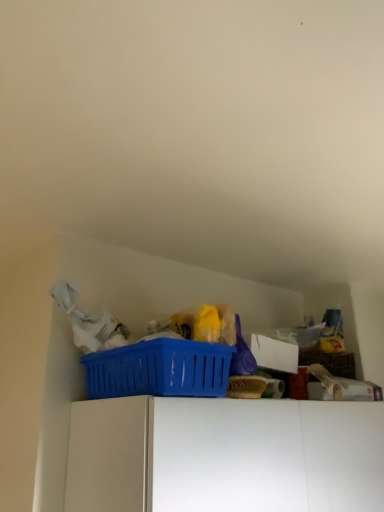
Question: Can you confirm if blue plastic basket at upper center is thinner than white matte cabinet at upper center?

Choices:
 (A) no
 (B) yes

Answer: (B)

Question: Is blue plastic basket at upper center looking in the opposite direction of white matte cabinet at upper center?

Choices:
 (A) no
 (B) yes

Answer: (A)

Question: Is blue plastic basket at upper center bigger than white matte cabinet at upper center?

Choices:
 (A) yes
 (B) no

Answer: (B)

Question: From a real-world perspective, is blue plastic basket at upper center on top of white matte cabinet at upper center?

Choices:
 (A) yes
 (B) no

Answer: (A)

Question: Is blue plastic basket at upper center positioned behind white matte cabinet at upper center?

Choices:
 (A) yes
 (B) no

Answer: (A)

Question: Is blue plastic basket at upper center with white matte cabinet at upper center?

Choices:
 (A) yes
 (B) no

Answer: (B)

Question: Is there a large distance between white matte cabinet at upper center and blue plastic basket at upper center?

Choices:
 (A) no
 (B) yes

Answer: (A)

Question: Would you say white matte cabinet at upper center is outside blue plastic basket at upper center?

Choices:
 (A) yes
 (B) no

Answer: (A)

Question: Is white matte cabinet at upper center oriented towards blue plastic basket at upper center?

Choices:
 (A) yes
 (B) no

Answer: (B)

Question: Considering the relative positions of white matte cabinet at upper center and blue plastic basket at upper center in the image provided, is white matte cabinet at upper center to the left of blue plastic basket at upper center from the viewer's perspective?

Choices:
 (A) no
 (B) yes

Answer: (A)

Question: Does white matte cabinet at upper center have a lesser height compared to blue plastic basket at upper center?

Choices:
 (A) no
 (B) yes

Answer: (A)

Question: Does white matte cabinet at upper center come in front of blue plastic basket at upper center?

Choices:
 (A) yes
 (B) no

Answer: (A)

Question: Considering the positions of white matte cabinet at upper center and blue plastic basket at upper center in the image, is white matte cabinet at upper center wider or thinner than blue plastic basket at upper center?

Choices:
 (A) thin
 (B) wide

Answer: (B)